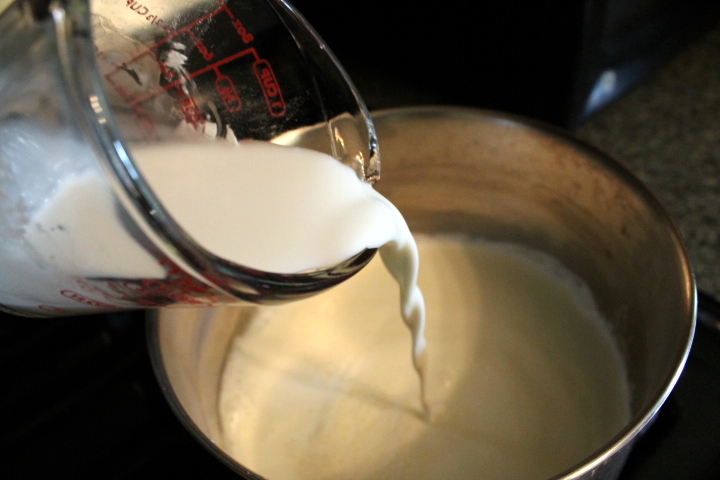
The image size is (720, 480). I want to click on table not  in image, so click(x=112, y=419).